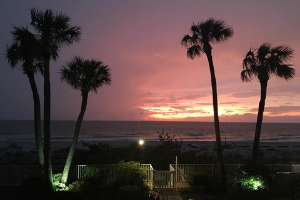
Locate an element on the screen. light is located at coordinates (142, 142).